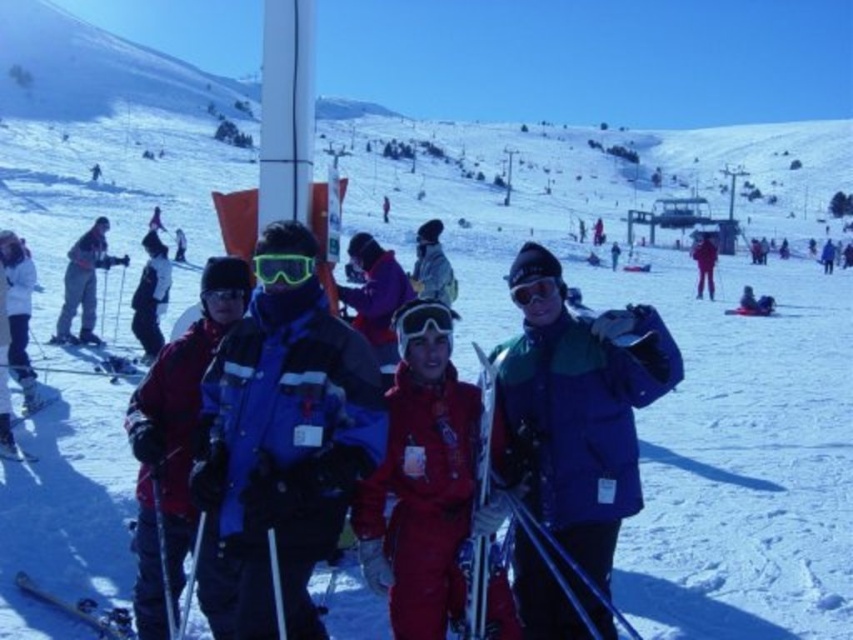
Question: Is blue fabric jacket at center to the right of transparent plastic goggles at center from the viewer's perspective?

Choices:
 (A) no
 (B) yes

Answer: (A)

Question: Which of the following is the farthest from the observer?

Choices:
 (A) white matte jacket at left
 (B) matte blue ski at lower left
 (C) glowing plastic goggles at center

Answer: (A)

Question: Does matte black skier at left appear over glowing plastic goggles at center?

Choices:
 (A) no
 (B) yes

Answer: (B)

Question: Which point is farther from the camera taking this photo?

Choices:
 (A) (483, 532)
 (B) (7, 410)

Answer: (B)

Question: Does white matte jacket at left appear over matte black jacket at center?

Choices:
 (A) no
 (B) yes

Answer: (A)

Question: Which of the following is the closest to the observer?

Choices:
 (A) (300, 253)
 (B) (135, 289)
 (C) (13, 234)

Answer: (A)